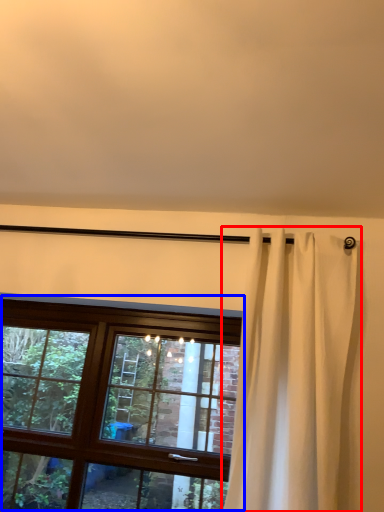
Question: Which of the following is the closest to the observer, curtain (highlighted by a red box) or window (highlighted by a blue box)?

Choices:
 (A) curtain
 (B) window

Answer: (A)